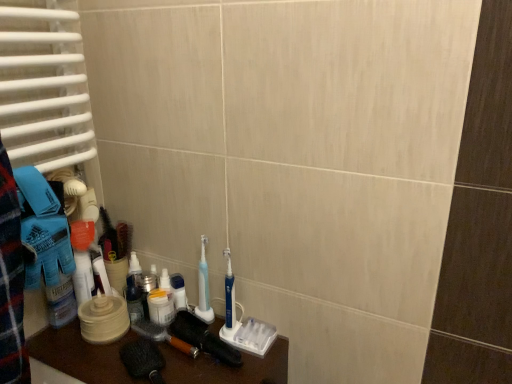
Question: Is blue plastic toothbrush at center, which ranks as the second toothbrush in left-to-right order, behind black rubber brush at lower center, which appears as the first brush when viewed from the right?

Choices:
 (A) no
 (B) yes

Answer: (B)

Question: Are blue plastic toothbrush at center, which ranks as the second toothbrush in left-to-right order, and black rubber brush at lower center, which appears as the first brush when viewed from the right, beside each other?

Choices:
 (A) yes
 (B) no

Answer: (A)

Question: From the image's perspective, is blue plastic toothbrush at center, which ranks as the second toothbrush in left-to-right order, on black rubber brush at lower center, which appears as the first brush when viewed from the right?

Choices:
 (A) no
 (B) yes

Answer: (B)

Question: Is black rubber brush at lower center, which appears as the first brush when viewed from the right, located within blue plastic toothbrush at center, which ranks as the second toothbrush in left-to-right order?

Choices:
 (A) yes
 (B) no

Answer: (B)

Question: Could you tell me if blue plastic toothbrush at center, acting as the first toothbrush starting from the right, is turned towards black rubber brush at lower center, which appears as the first brush when viewed from the right?

Choices:
 (A) no
 (B) yes

Answer: (A)

Question: Is there a large distance between blue plastic toothbrush at center, acting as the first toothbrush starting from the right, and black rubber brush at lower center, which appears as the first brush when viewed from the right?

Choices:
 (A) yes
 (B) no

Answer: (B)

Question: Would you say black rubber brush at lower center, the second brush in the left-to-right sequence, contains blue plastic toothbrush at center, acting as the first toothbrush starting from the right?

Choices:
 (A) yes
 (B) no

Answer: (B)

Question: Is black rubber brush at lower center, the second brush in the left-to-right sequence, far from blue plastic toothbrush at center, acting as the first toothbrush starting from the right?

Choices:
 (A) yes
 (B) no

Answer: (B)

Question: From a real-world perspective, is black rubber brush at lower center, which appears as the first brush when viewed from the right, over blue plastic toothbrush at center, which ranks as the second toothbrush in left-to-right order?

Choices:
 (A) no
 (B) yes

Answer: (A)

Question: Does black rubber brush at lower center, which appears as the first brush when viewed from the right, have a smaller size compared to blue plastic toothbrush at center, acting as the first toothbrush starting from the right?

Choices:
 (A) yes
 (B) no

Answer: (B)

Question: Is black rubber brush at lower center, which appears as the first brush when viewed from the right, located outside blue plastic toothbrush at center, which ranks as the second toothbrush in left-to-right order?

Choices:
 (A) yes
 (B) no

Answer: (A)

Question: Is blue plastic toothbrush at center, which ranks as the second toothbrush in left-to-right order, at the back of black rubber brush at lower center, which appears as the first brush when viewed from the right?

Choices:
 (A) yes
 (B) no

Answer: (B)

Question: Is blue plastic toothbrush at center, acting as the first toothbrush starting from the right, in front of white plastic container at center, which is the 1th toiletry from right to left?

Choices:
 (A) no
 (B) yes

Answer: (B)